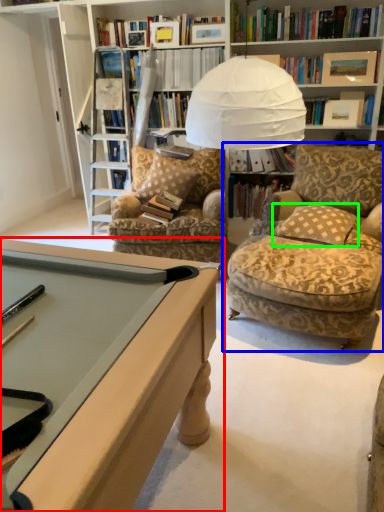
Question: Estimate the real-world distances between objects in this image. Which object is closer to desk (highlighted by a red box), chair (highlighted by a blue box) or pillow (highlighted by a green box)?

Choices:
 (A) chair
 (B) pillow

Answer: (A)